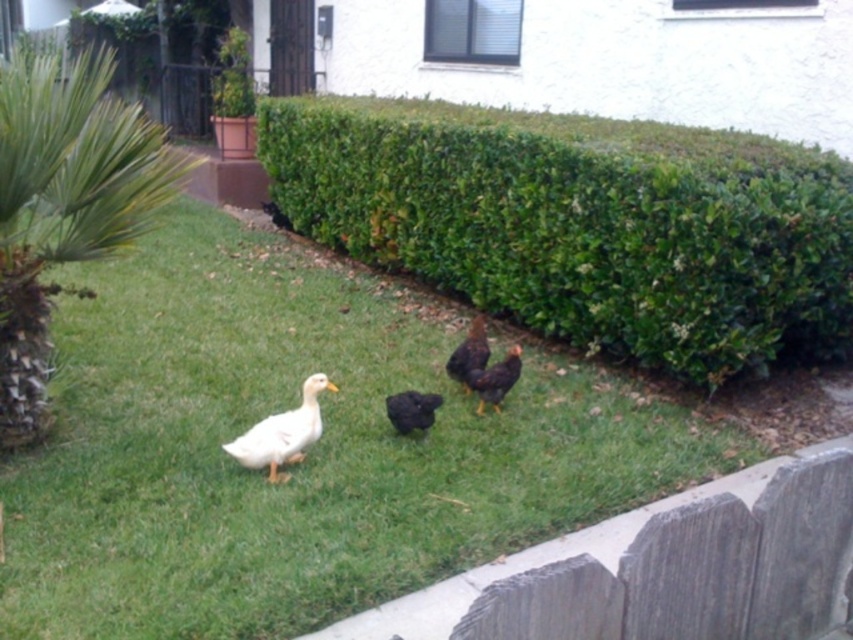
You are a small robot trying to reach the brown matte chicken at center from the gray wood fence at lower right. Can you move directly towards the chicken without going around the fence?

The gray wood fence at lower right is in front of the brown matte chicken at center, so the fence is blocking the path. You would need to go around the fence to reach the chicken.